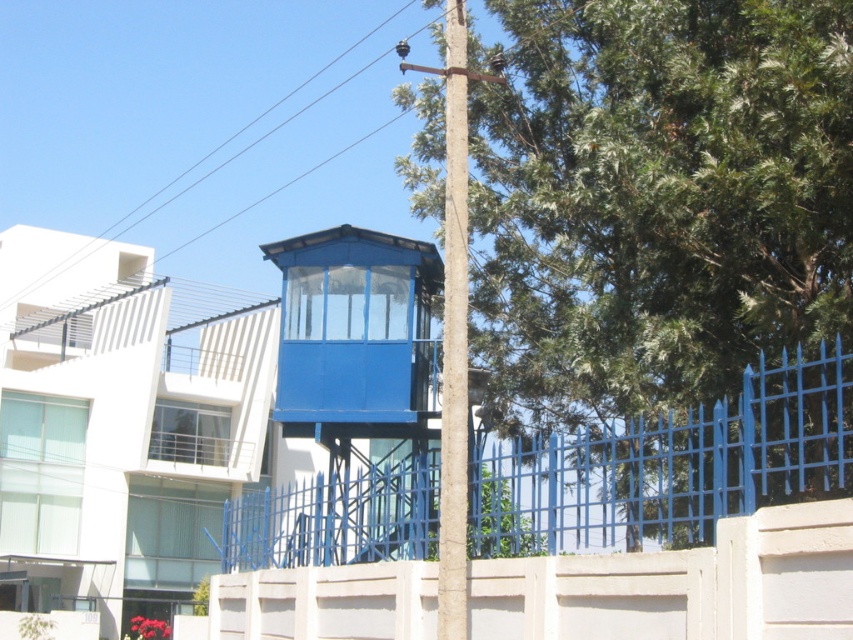
Who is shorter, green leafy tree at center or brown textured pole at center?

With less height is brown textured pole at center.

Who is higher up, green leafy tree at center or brown textured pole at center?

Positioned higher is brown textured pole at center.

I want to click on green leafy tree at center, so click(x=669, y=250).

Is smooth wire at upper center to the right of metallic blue fence at center from the viewer's perspective?

In fact, smooth wire at upper center is to the left of metallic blue fence at center.

Is point (83, 83) farther from camera compared to point (485, 483)?

Yes, point (83, 83) is farther from viewer.

Does point (94, 99) come in front of point (477, 461)?

No, it is behind (477, 461).

This screenshot has height=640, width=853. Identify the location of smooth wire at upper center. (198, 129).

How distant is metallic blue fence at center from brown textured pole at center?

9.04 feet

Is point (555, 548) positioned after point (442, 593)?

No, it is in front of (442, 593).

Find the location of `metallic blue fence at center`. metallic blue fence at center is located at coordinates (671, 465).

The width and height of the screenshot is (853, 640). Find the location of `metallic blue fence at center`. metallic blue fence at center is located at coordinates (671, 465).